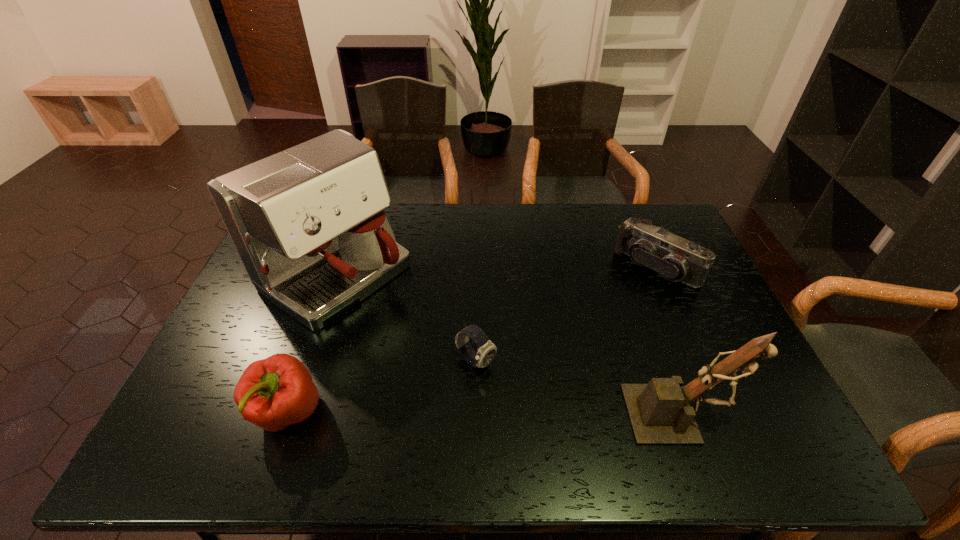
You are a GUI agent. You are given a task and a screenshot of the screen. Output one action in this format:
    pyautogui.click(x=<x>, y=<y>)
    Task: Click on the vacant space in between the tallest object and the figurine
    The height and width of the screenshot is (540, 960).
    Given the screenshot: What is the action you would take?
    pyautogui.click(x=508, y=344)

Where is `free space between the camcorder and the bell pepper`? free space between the camcorder and the bell pepper is located at coordinates (471, 340).

At what (x,y) coordinates should I click in order to perform the action: click on vacant area between the third nearest object and the second tallest object. Please return your answer as a coordinate pair (x, y). The image size is (960, 540). Looking at the image, I should click on (578, 388).

This screenshot has width=960, height=540. I want to click on vacant space in between the watch and the second tallest object, so click(578, 388).

Locate an element on the screen. vacant space in between the coffee maker and the bell pepper is located at coordinates (312, 343).

Find the location of a particular element. vacant area that lies between the bell pepper and the tallest object is located at coordinates (312, 343).

At what (x,y) coordinates should I click in order to perform the action: click on free space between the figurine and the coffee maker. Please return your answer as a coordinate pair (x, y). Looking at the image, I should click on (508, 344).

Where is `unoccupied area between the coffee maker and the fourth shortest object`? unoccupied area between the coffee maker and the fourth shortest object is located at coordinates (508, 344).

The height and width of the screenshot is (540, 960). In order to click on unoccupied position between the camcorder and the bell pepper in this screenshot , I will do `click(471, 340)`.

Where is `object identified as the second closest to the bell pepper`? This screenshot has height=540, width=960. object identified as the second closest to the bell pepper is located at coordinates (487, 350).